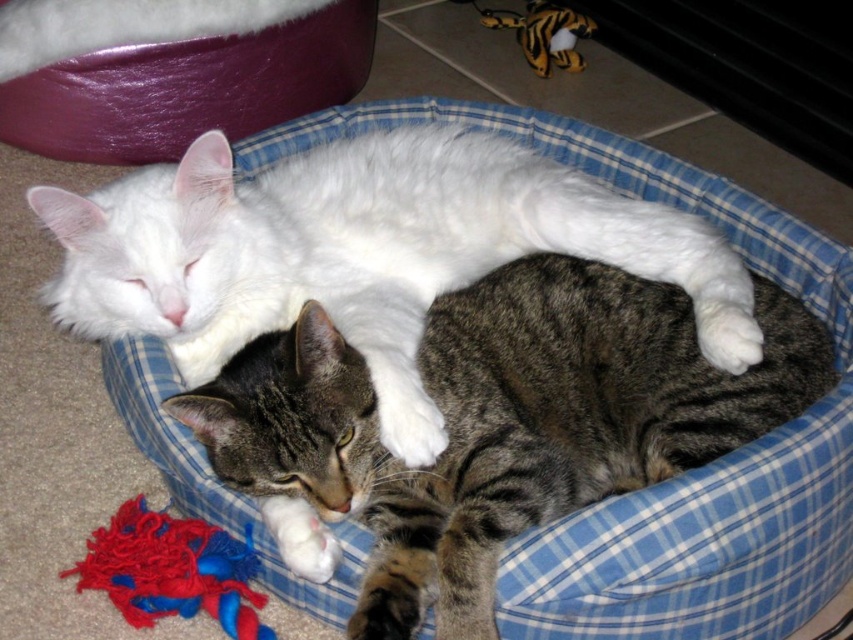
Based on the photo, you are a pet owner who wants to retrieve the yarn fabric toy at lower left from the white fluffy cat at center. Can you easily grab the toy without disturbing the cat?

The white fluffy cat at center is positioned over yarn fabric toy at lower left, so grabbing the toy might disturb the cat since it is covering the toy.

You are a cat owner who wants to place a new toy for your cat. The current toy is the yarn fabric toy at lower left. You want to place the new toy so that it is twice as far from the white fluffy cat at center as the current toy. Where should you place the new toy?

The current distance between the white fluffy cat at center and the yarn fabric toy at lower left is 15.68 inches. To place the new toy twice as far, it should be placed 31.36 inches away from the white fluffy cat at center in the opposite direction from the yarn fabric toy at lower left.